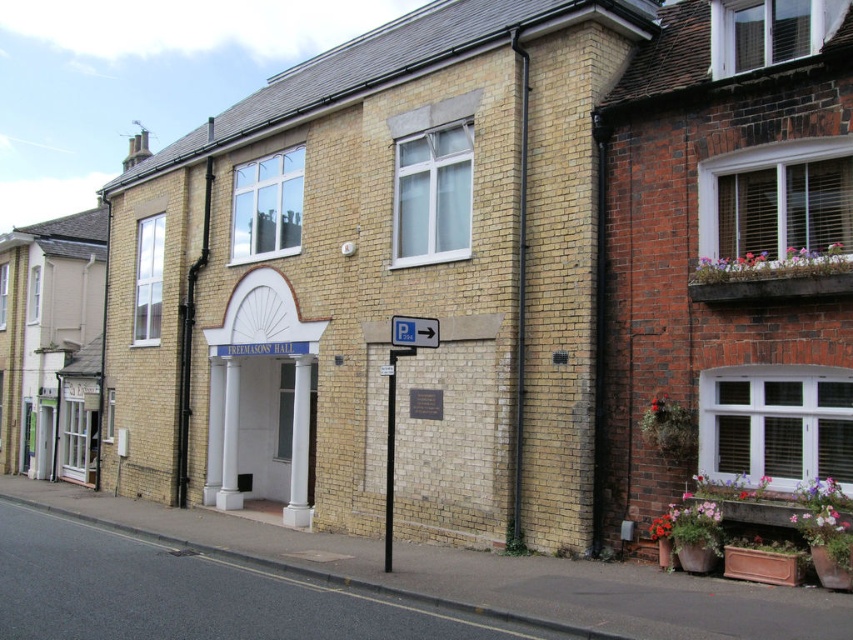
Who is taller, smooth black pole at center or white plastic sign at center?

Standing taller between the two is smooth black pole at center.

The image size is (853, 640). Describe the element at coordinates (389, 465) in the screenshot. I see `smooth black pole at center` at that location.

Image resolution: width=853 pixels, height=640 pixels. Find the location of `smooth black pole at center`. smooth black pole at center is located at coordinates (389, 465).